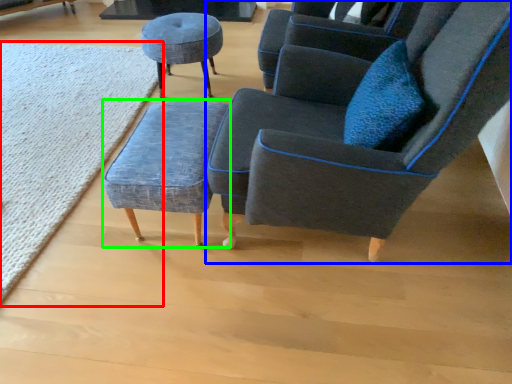
Question: Which object is positioned farthest from mat (highlighted by a red box)? Select from chair (highlighted by a blue box) and stool (highlighted by a green box).

Choices:
 (A) chair
 (B) stool

Answer: (A)